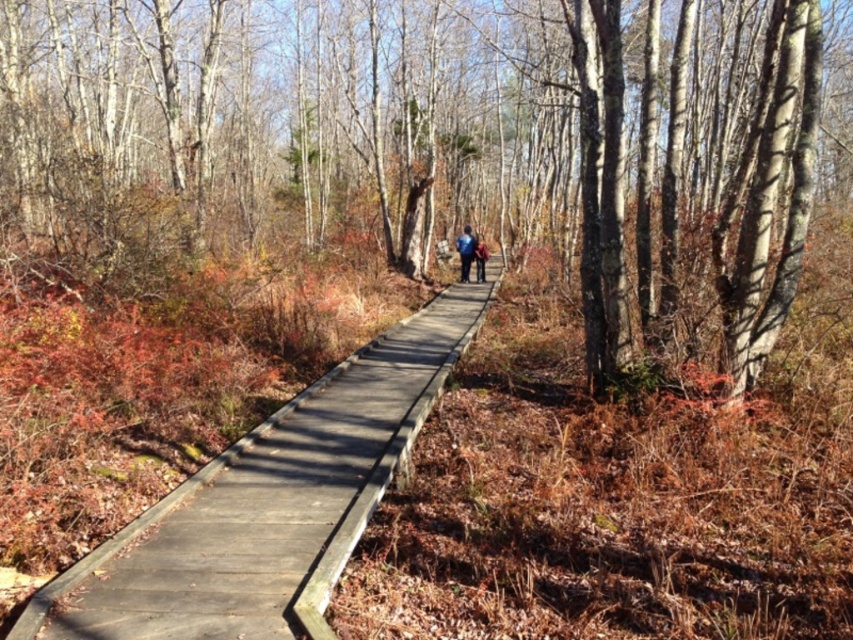
You are standing at the starting point of the boardwalk and want to reach a point that is closer to the camera. Which point should you head towards, point (660, 230) or point (236, 476)?

You should head towards point (236, 476) because it is closer to the camera compared to point (660, 230), which is further away.

You are a hiker who wants to place both the blue fabric jacket at center and the dark blue jacket at center on a narrow bench. Which jacket should you place first to ensure both fit on the bench?

You should place the dark blue jacket at center first because the blue fabric jacket at center might be wider, so placing the wider one first ensures both can fit on the narrow bench.